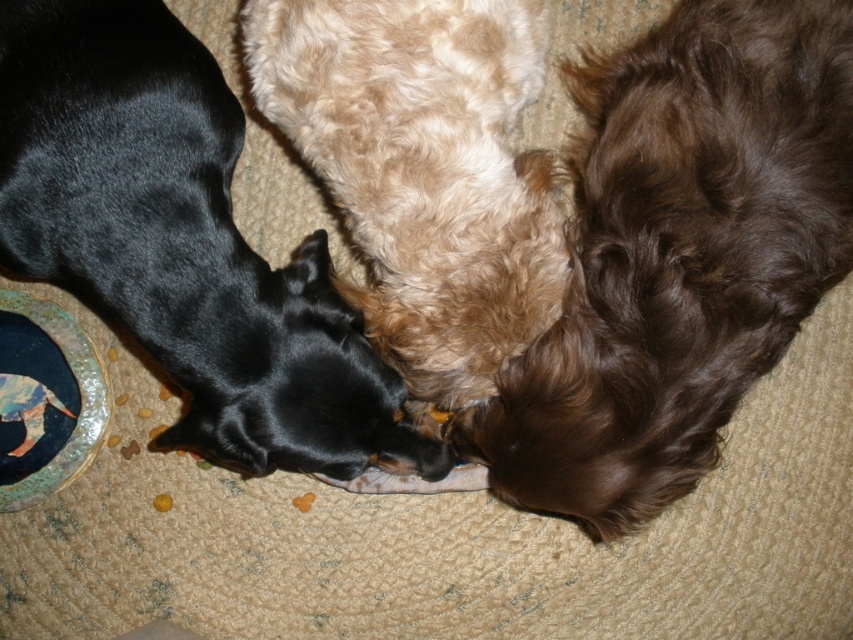
You are a dog owner who wants to place a new toy between the brown curly fur at right and the fuzzy beige dog at center. Based on their positions, where should you place the toy to ensure it is between them?

The brown curly fur at right is positioned on the right side of fuzzy beige dog at center, so you should place the toy to the left of the brown curly fur at right and to the right of the fuzzy beige dog at center to ensure it is between them.

You are standing in front of the image of three dogs resting on a carpet. You notice two points marked in the scene. Which of the two points, point (285,397) or point (514,324), is closer to you?

Point (285,397) is closer to the viewer than point (514,324).